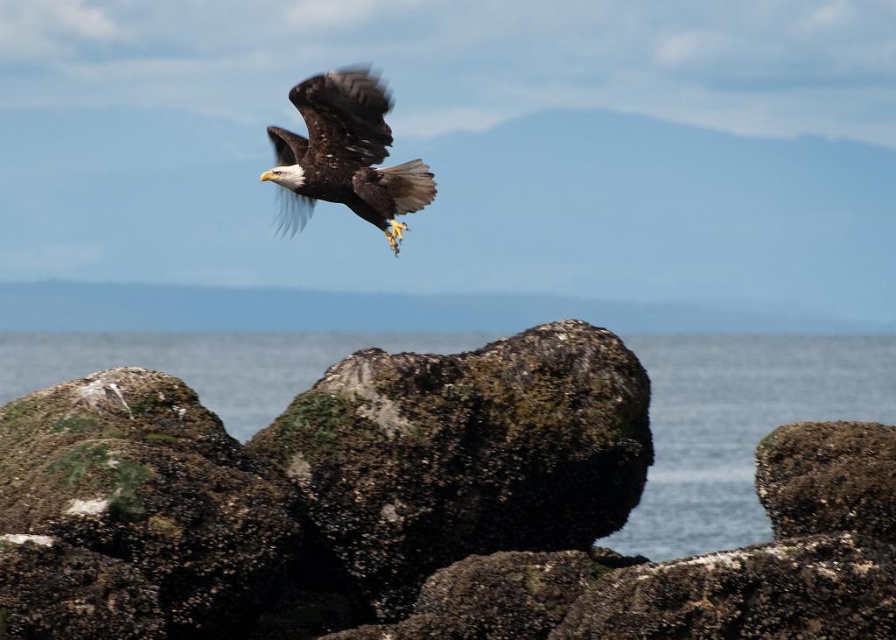
You are a birdwatcher observing the brown feathered eagle at upper center and the transparent water at center. Which object is located below the other?

The transparent water at center is positioned under the brown feathered eagle at upper center, so the transparent water at center is below the brown feathered eagle at upper center.

You are a birdwatcher observing the scene. You notice the mossy rock at center and the brown feathered eagle at upper center. Which object occupies a larger area in the image?

The mossy rock at center is bigger than the brown feathered eagle at upper center, so the mossy rock at center occupies a larger area in the image.

You are a photographer trying to capture the bald eagle in flight. You notice the mossy rock at center and the transparent water at center in your viewfinder. Which object appears taller in the photo?

The transparent water at center appears taller than the mossy rock at center because the mossy rock at center is not as tall as transparent water at center.